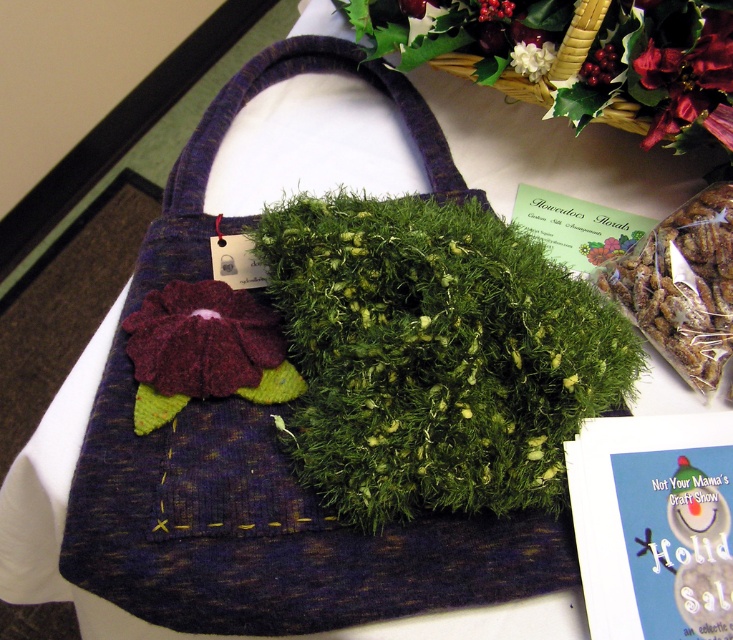
Question: Estimate the real-world distances between objects in this image. Which object is closer to the white fluffy flower at upper center?

Choices:
 (A) green mossy flower at upper center
 (B) green fuzzy flower at upper center
 (C) velvety purple flower at center
 (D) shiny red flower at upper right

Answer: (A)

Question: Which point is closer to the camera?

Choices:
 (A) (615, 56)
 (B) (668, 58)
 (C) (718, 378)
 (D) (629, 244)

Answer: (B)

Question: From the image, what is the correct spatial relationship of white fluffy flower at upper center in relation to green mossy flower at upper center?

Choices:
 (A) right
 (B) left

Answer: (B)

Question: Can you confirm if shiny brown nuts at upper right is positioned above velvety purple flower at center?

Choices:
 (A) yes
 (B) no

Answer: (B)

Question: Which point is closer to the camera?

Choices:
 (A) green mossy flower at upper center
 (B) shiny brown nuts at upper right

Answer: (B)

Question: Is shiny red flower at upper right thinner than velvety purple flower at center?

Choices:
 (A) yes
 (B) no

Answer: (B)